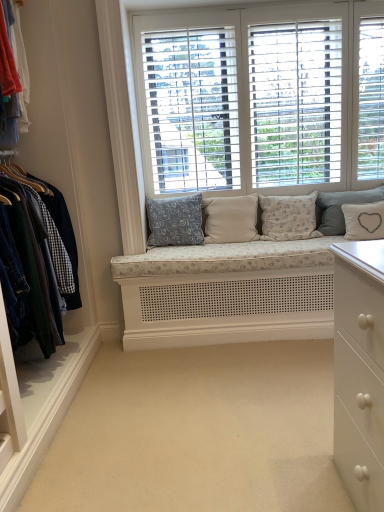
Locate an element on the screen. beige fabric cushion at center, which is the 4th pillow from right to left is located at coordinates (231, 219).

In order to face white fabric pillow with heart design at center, which ranks as the 1th pillow in right-to-left order, should I rotate leftwards or rightwards?

You should look right and rotate roughly 22.403 degrees.

This screenshot has height=512, width=384. What do you see at coordinates (197, 433) in the screenshot? I see `beige carpet at center` at bounding box center [197, 433].

Locate an element on the screen. white linen pillow at right, the 4th pillow when ordered from left to right is located at coordinates (341, 208).

Describe the element at coordinates (341, 208) in the screenshot. I see `white linen pillow at right, which appears as the second pillow when viewed from the right` at that location.

Image resolution: width=384 pixels, height=512 pixels. What are the coordinates of `blue floral fabric pillow at center, the 1th pillow viewed from the left` in the screenshot? It's located at click(x=175, y=221).

Describe the element at coordinates (38, 257) in the screenshot. I see `denim jacket at left` at that location.

Identify the location of beige fabric cushion at center, the 2th pillow in the left-to-right sequence. (231, 219).

From the image's perspective, is beige carpet at center on top of white fabric pillow with heart design at center, which ranks as the 1th pillow in right-to-left order?

No.

This screenshot has height=512, width=384. There is a beige carpet at center. Identify the location of the 1st pillow above it (from a real-world perspective). (364, 221).

Which is less distant, (117,349) or (359,239)?

Point (117,349) is farther from the camera than point (359,239).

Does beige carpet at center touch white fabric pillow with heart design at center, which ranks as the 5th pillow in left-to-right order?

No, beige carpet at center is not in contact with white fabric pillow with heart design at center, which ranks as the 5th pillow in left-to-right order.

From a real-world perspective, between white wood window at center and white linen pillow at right, the 4th pillow when ordered from left to right, who is vertically lower?

In real-world perspective, white linen pillow at right, the 4th pillow when ordered from left to right, is lower.

From the image's perspective, would you say white wood window at center is shown under white linen pillow at right, which appears as the second pillow when viewed from the right?

No, from the image's perspective, white wood window at center is not beneath white linen pillow at right, which appears as the second pillow when viewed from the right.

What's the angular difference between white wood window at center and white linen pillow at right, which appears as the second pillow when viewed from the right,'s facing directions?

The facing directions of white wood window at center and white linen pillow at right, which appears as the second pillow when viewed from the right, are 1.7 degrees apart.

Does white wood window at center turn towards white linen pillow at right, which appears as the second pillow when viewed from the right?

No, white wood window at center is not oriented towards white linen pillow at right, which appears as the second pillow when viewed from the right.

Who is more distant, fluffy white pillow at center, the 3th pillow in the left-to-right sequence, or white linen pillow at right, the 4th pillow when ordered from left to right?

white linen pillow at right, the 4th pillow when ordered from left to right, is more distant.

From the picture: Is fluffy white pillow at center, the 3th pillow in the left-to-right sequence, situated inside white linen pillow at right, which appears as the second pillow when viewed from the right, or outside?

fluffy white pillow at center, the 3th pillow in the left-to-right sequence, is not inside white linen pillow at right, which appears as the second pillow when viewed from the right, it's outside.

Measure the distance between fluffy white pillow at center, positioned as the 3th pillow in right-to-left order, and white linen pillow at right, the 4th pillow when ordered from left to right.

fluffy white pillow at center, positioned as the 3th pillow in right-to-left order, and white linen pillow at right, the 4th pillow when ordered from left to right, are 7.96 inches apart from each other.

From a real-world perspective, which is physically above, fluffy white pillow at center, the 3th pillow in the left-to-right sequence, or white linen pillow at right, the 4th pillow when ordered from left to right?

fluffy white pillow at center, the 3th pillow in the left-to-right sequence.

Considering the relative sizes of fluffy white pillow at center, the 3th pillow in the left-to-right sequence, and white fabric pillow with heart design at center, which ranks as the 5th pillow in left-to-right order, in the image provided, is fluffy white pillow at center, the 3th pillow in the left-to-right sequence, wider than white fabric pillow with heart design at center, which ranks as the 5th pillow in left-to-right order,?

Correct, the width of fluffy white pillow at center, the 3th pillow in the left-to-right sequence, exceeds that of white fabric pillow with heart design at center, which ranks as the 5th pillow in left-to-right order.

Is fluffy white pillow at center, positioned as the 3th pillow in right-to-left order, inside or outside of white fabric pillow with heart design at center, which ranks as the 1th pillow in right-to-left order?

fluffy white pillow at center, positioned as the 3th pillow in right-to-left order, lies outside white fabric pillow with heart design at center, which ranks as the 1th pillow in right-to-left order.

Which is more to the right, denim jacket at left or white fabric pillow with heart design at center, which ranks as the 5th pillow in left-to-right order?

white fabric pillow with heart design at center, which ranks as the 5th pillow in left-to-right order, is more to the right.

Relative to white fabric pillow with heart design at center, which ranks as the 1th pillow in right-to-left order, is denim jacket at left in front or behind?

In the image, denim jacket at left appears in front of white fabric pillow with heart design at center, which ranks as the 1th pillow in right-to-left order.

Considering the sizes of objects denim jacket at left and white fabric pillow with heart design at center, which ranks as the 5th pillow in left-to-right order, in the image provided, who is wider, denim jacket at left or white fabric pillow with heart design at center, which ranks as the 5th pillow in left-to-right order,?

denim jacket at left.

Is blue floral fabric pillow at center, the 1th pillow viewed from the left, oriented away from beige fabric cushion at center, the 2th pillow in the left-to-right sequence?

blue floral fabric pillow at center, the 1th pillow viewed from the left, is not turned away from beige fabric cushion at center, the 2th pillow in the left-to-right sequence.

The image size is (384, 512). I want to click on pillow located on the left of beige fabric cushion at center, the 2th pillow in the left-to-right sequence, so click(175, 221).

Considering their positions, is blue floral fabric pillow at center, the 1th pillow viewed from the left, located in front of or behind beige fabric cushion at center, the 2th pillow in the left-to-right sequence?

In the image, blue floral fabric pillow at center, the 1th pillow viewed from the left, appears in front of beige fabric cushion at center, the 2th pillow in the left-to-right sequence.

From the image's perspective, does blue floral fabric pillow at center, which appears as the fifth pillow when viewed from the right, appear lower than beige fabric cushion at center, which is the 4th pillow from right to left?

Indeed, from the image's perspective, blue floral fabric pillow at center, which appears as the fifth pillow when viewed from the right, is shown beneath beige fabric cushion at center, which is the 4th pillow from right to left.

Could you measure the distance between beige fabric cushion at center, which is the 4th pillow from right to left, and white fabric pillow with heart design at center, which ranks as the 5th pillow in left-to-right order?

The distance of beige fabric cushion at center, which is the 4th pillow from right to left, from white fabric pillow with heart design at center, which ranks as the 5th pillow in left-to-right order, is 67.78 centimeters.

From the image's perspective, which is below, beige fabric cushion at center, which is the 4th pillow from right to left, or white fabric pillow with heart design at center, which ranks as the 5th pillow in left-to-right order?

white fabric pillow with heart design at center, which ranks as the 5th pillow in left-to-right order, from the image's perspective.

Which is correct: beige fabric cushion at center, which is the 4th pillow from right to left, is inside white fabric pillow with heart design at center, which ranks as the 1th pillow in right-to-left order, or outside of it?

beige fabric cushion at center, which is the 4th pillow from right to left, is spatially situated outside white fabric pillow with heart design at center, which ranks as the 1th pillow in right-to-left order.

Does point (206, 214) appear closer or farther from the camera than point (380, 210)?

Point (206, 214) is positioned farther from the camera compared to point (380, 210).

The image size is (384, 512). Find the location of `pillow that is the 1st one when counting upward from the beige carpet at center (from the image's perspective)`. pillow that is the 1st one when counting upward from the beige carpet at center (from the image's perspective) is located at coordinates (364, 221).

What are the coordinates of `window in front of the white linen pillow at right, which appears as the second pillow when viewed from the right` in the screenshot? It's located at pos(261,98).

Considering their positions, is fluffy white pillow at center, the 3th pillow in the left-to-right sequence, positioned closer to denim jacket at left than beige carpet at center?

beige carpet at center is positioned closer to the anchor denim jacket at left.

Estimate the real-world distances between objects in this image. Which object is closer to fluffy white pillow at center, the 3th pillow in the left-to-right sequence, white wood window at center or denim jacket at left?

white wood window at center is closer to fluffy white pillow at center, the 3th pillow in the left-to-right sequence.

Estimate the real-world distances between objects in this image. Which object is further from white fabric pillow with heart design at center, which ranks as the 5th pillow in left-to-right order, white wood window at center or beige carpet at center?

beige carpet at center is further to white fabric pillow with heart design at center, which ranks as the 5th pillow in left-to-right order.

Estimate the real-world distances between objects in this image. Which object is further from fluffy white pillow at center, positioned as the 3th pillow in right-to-left order, blue floral fabric pillow at center, the 1th pillow viewed from the left, or denim jacket at left?

denim jacket at left is further to fluffy white pillow at center, positioned as the 3th pillow in right-to-left order.

Estimate the real-world distances between objects in this image. Which object is closer to beige fabric cushion at center, the 2th pillow in the left-to-right sequence, denim jacket at left or white fabric pillow with heart design at center, which ranks as the 5th pillow in left-to-right order?

The object closer to beige fabric cushion at center, the 2th pillow in the left-to-right sequence, is white fabric pillow with heart design at center, which ranks as the 5th pillow in left-to-right order.

When comparing their distances from white linen pillow at right, the 4th pillow when ordered from left to right, does blue floral fabric pillow at center, which appears as the fifth pillow when viewed from the right, or beige fabric cushion at center, the 2th pillow in the left-to-right sequence, seem further?

The object further to white linen pillow at right, the 4th pillow when ordered from left to right, is blue floral fabric pillow at center, which appears as the fifth pillow when viewed from the right.

From the image, which object appears to be nearer to white fabric pillow with heart design at center, which ranks as the 1th pillow in right-to-left order, beige fabric cushion at center, which is the 4th pillow from right to left, or blue floral fabric pillow at center, which appears as the fifth pillow when viewed from the right?

beige fabric cushion at center, which is the 4th pillow from right to left, is positioned closer to the anchor white fabric pillow with heart design at center, which ranks as the 1th pillow in right-to-left order.

Which object lies further to the anchor point white fabric pillow with heart design at center, which ranks as the 5th pillow in left-to-right order, beige carpet at center or fluffy white pillow at center, positioned as the 3th pillow in right-to-left order?

Among the two, beige carpet at center is located further to white fabric pillow with heart design at center, which ranks as the 5th pillow in left-to-right order.

The height and width of the screenshot is (512, 384). I want to click on pillow between beige carpet at center and fluffy white pillow at center, the 3th pillow in the left-to-right sequence, along the z-axis, so click(364, 221).

Where is `window between denim jacket at left and fluffy white pillow at center, positioned as the 3th pillow in right-to-left order`? This screenshot has width=384, height=512. window between denim jacket at left and fluffy white pillow at center, positioned as the 3th pillow in right-to-left order is located at coordinates (261, 98).

Where is `pillow between fluffy white pillow at center, positioned as the 3th pillow in right-to-left order, and white fabric pillow with heart design at center, which ranks as the 1th pillow in right-to-left order, in the horizontal direction`? This screenshot has width=384, height=512. pillow between fluffy white pillow at center, positioned as the 3th pillow in right-to-left order, and white fabric pillow with heart design at center, which ranks as the 1th pillow in right-to-left order, in the horizontal direction is located at coordinates (341, 208).

I want to click on pillow situated between blue floral fabric pillow at center, which appears as the fifth pillow when viewed from the right, and fluffy white pillow at center, the 3th pillow in the left-to-right sequence, from left to right, so click(x=231, y=219).